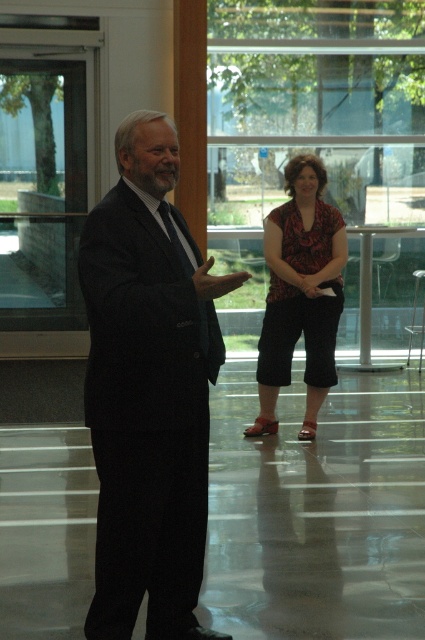
You are an event planner organizing a presentation. You need to ensure that the speaker is visible to the audience. Given the description of the matte black suit at center and the black silk tie at center, which object should be positioned closer to the audience to ensure visibility?

The matte black suit at center is taller than the black silk tie at center, so positioning the speaker wearing the matte black suit at center closer to the audience will ensure better visibility as it is taller.

You are an event planner organizing a presentation. You need to ensure that the speaker in the matte black suit at center can be seen clearly by the audience. Considering their positions, is the floral fabric blouse at center blocking the speaker?

The matte black suit at center is positioned under the floral fabric blouse at center, so the floral fabric blouse at center is above the speaker. This means the floral fabric blouse at center might be blocking the speaker from the audience unless the speaker is elevated or the blouse wearer moves aside.

You are standing at point 0.0, 0.0 in the room. You need to walk to the matte black suit at center. Which direction should you go?

The matte black suit at center is located at point (x=149, y=390), so you should move towards the northeast direction to reach it.